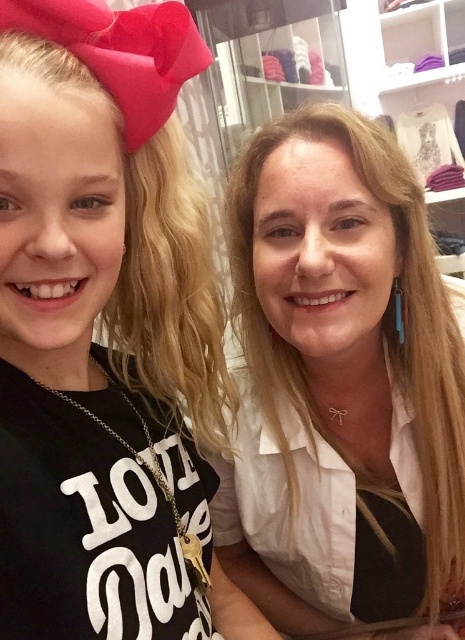
Can you confirm if black matte shirt at left is positioned above white satin blouse at center?

Indeed, black matte shirt at left is positioned over white satin blouse at center.

In the scene shown: Can you confirm if black matte shirt at left is smaller than white satin blouse at center?

Yes.

What do you see at coordinates (107, 333) in the screenshot?
I see `black matte shirt at left` at bounding box center [107, 333].

Find the location of `black matte shirt at left`. black matte shirt at left is located at coordinates (107, 333).